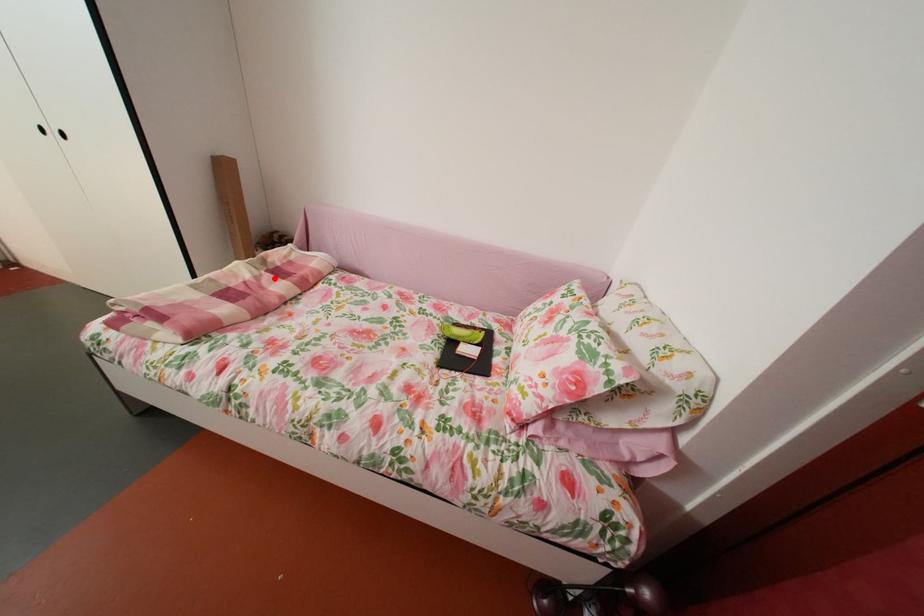
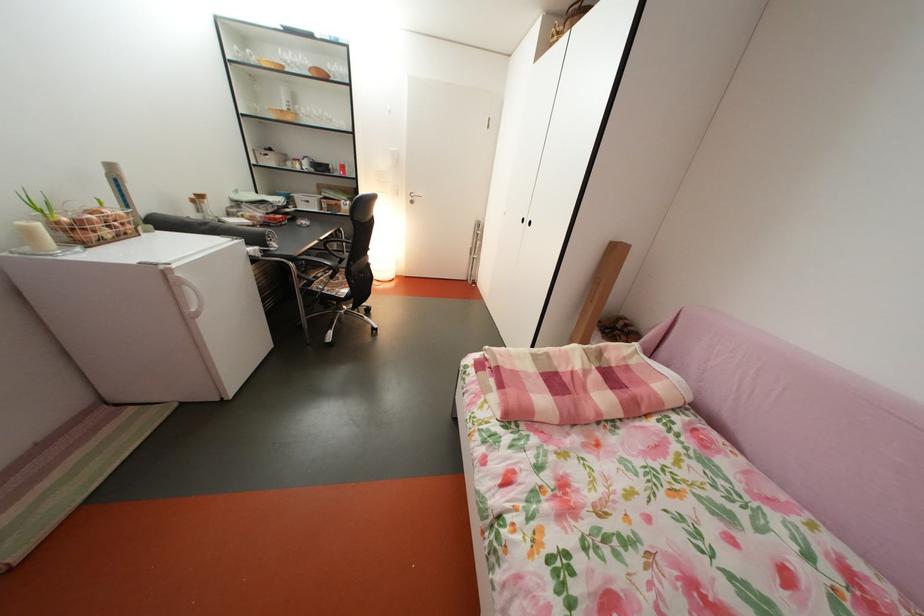
Where in the second image is the point corresponding to the highlighted location from the first image?

(604, 374)